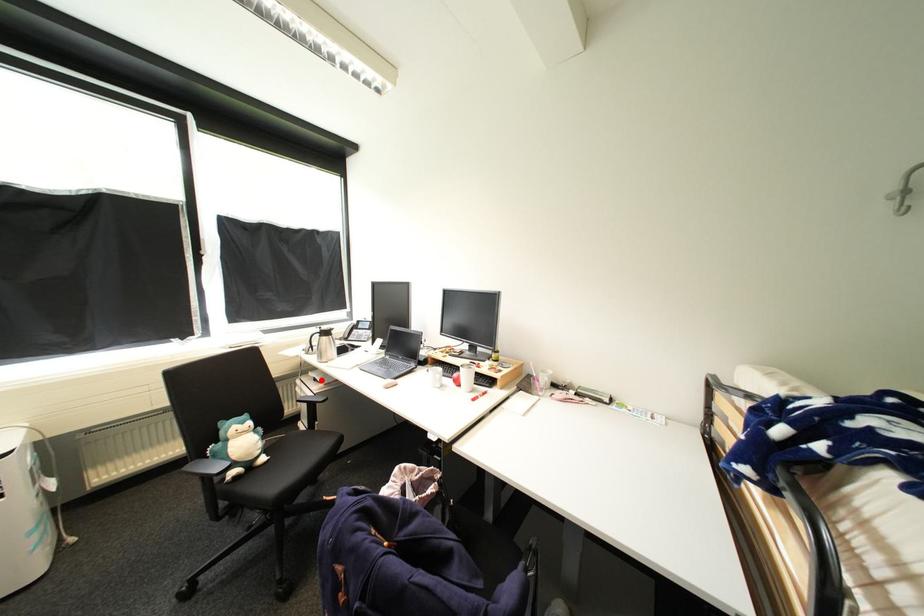
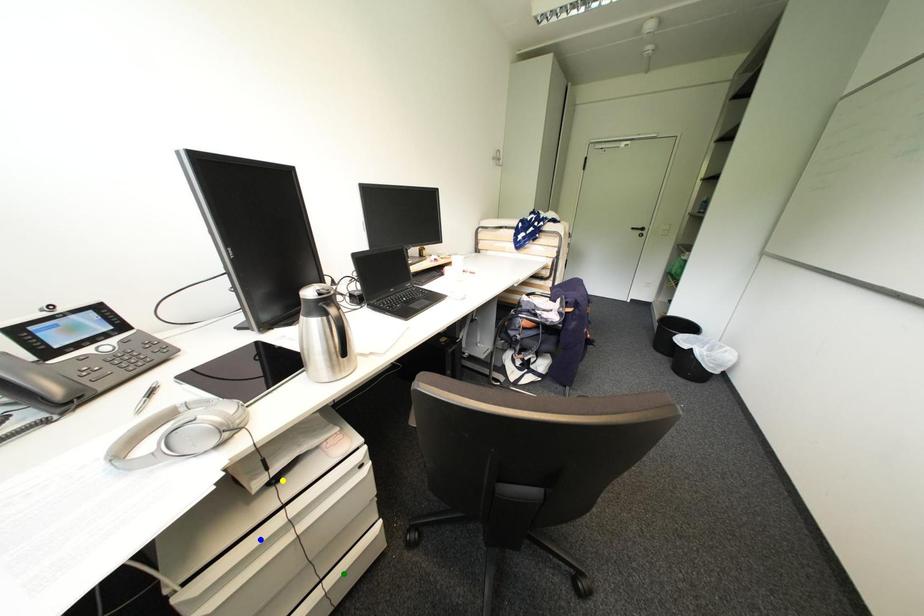
Question: I am providing you with two images of the same scene from different viewpoints. A red point is marked on the first image. You are given multiple points on the second image. Can you choose the point in image 2 that corresponds to the point in image 1?

Choices:
 (A) yellow point
 (B) green point
 (C) blue point

Answer: (A)